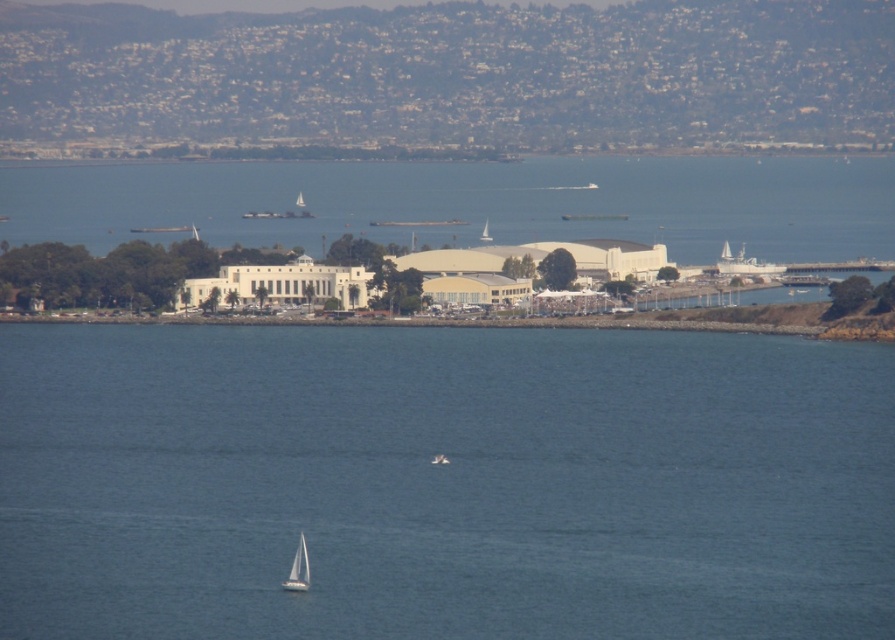
You are standing on the shore of the coastal scene and want to reach the white matte sailboat at lower center. Based on the distance provided, is it feasible to walk to the sailboat within 10 minutes if your walking speed is 3 miles per hour?

The white matte sailboat at lower center is 2145.49 feet away from viewer. At a walking speed of 3 miles per hour, it would take approximately 14 minutes to walk that distance, so it is not feasible to reach it within 10 minutes.

You are standing on a pier and looking at the blue water at center and the white matte sailboat at lower center. Which object is closer to the horizon?

The blue water at center is above the white matte sailboat at lower center, so the sailboat is closer to the horizon than the water.